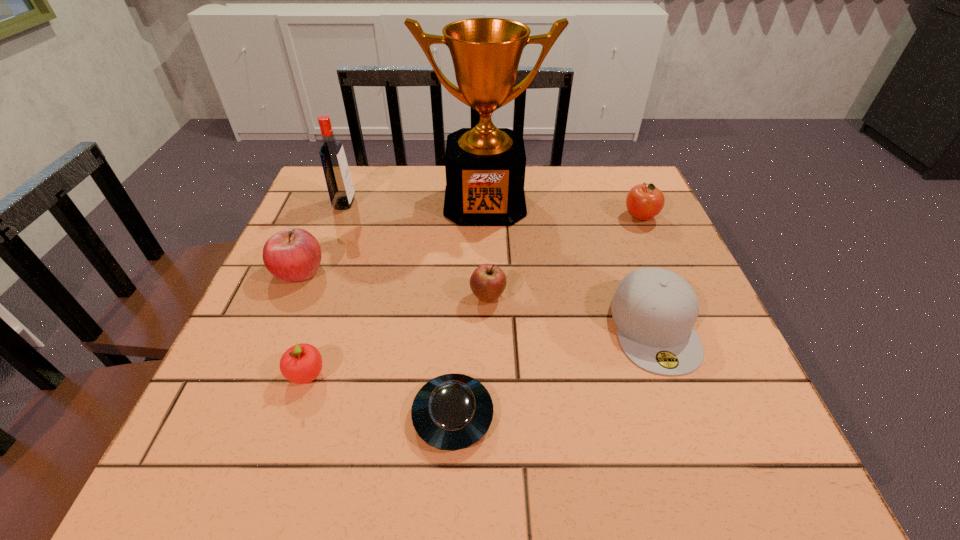
This screenshot has height=540, width=960. Identify the location of vacant space located on the front of the farthest apple. (676, 298).

This screenshot has height=540, width=960. Identify the location of free space located on the back of the leftmost apple. click(x=318, y=226).

At what (x,y) coordinates should I click in order to perform the action: click on vacant region located 0.080m on the front-facing side of the cap. Please return your answer as a coordinate pair (x, y). Image resolution: width=960 pixels, height=540 pixels. Looking at the image, I should click on (687, 417).

This screenshot has width=960, height=540. In order to click on vacant region located on the front of the third apple from left to right in this screenshot , I will do `click(492, 481)`.

Locate an element on the screen. This screenshot has height=540, width=960. free location located 0.230m on the right of the third apple from right to left is located at coordinates (454, 374).

You are a GUI agent. You are given a task and a screenshot of the screen. Output one action in this format:
    pyautogui.click(x=<x>, y=<y>)
    Task: Click on the free region located on the right of the saucer
    The width and height of the screenshot is (960, 540).
    Given the screenshot: What is the action you would take?
    click(x=673, y=416)

Locate an element on the screen. trophy cup present at the far edge is located at coordinates (485, 166).

Identify the location of vodka at the far edge. The width and height of the screenshot is (960, 540). (336, 171).

Locate an element on the screen. The width and height of the screenshot is (960, 540). apple situated at the far edge is located at coordinates (644, 201).

Identify the location of object located at the near edge. (450, 412).